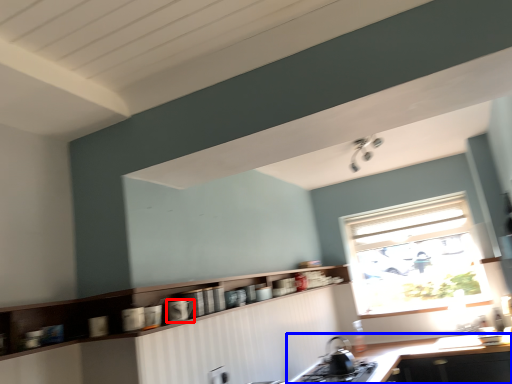
Question: Which of the following is the closest to the observer, appliance (highlighted by a red box) or countertop (highlighted by a blue box)?

Choices:
 (A) appliance
 (B) countertop

Answer: (A)